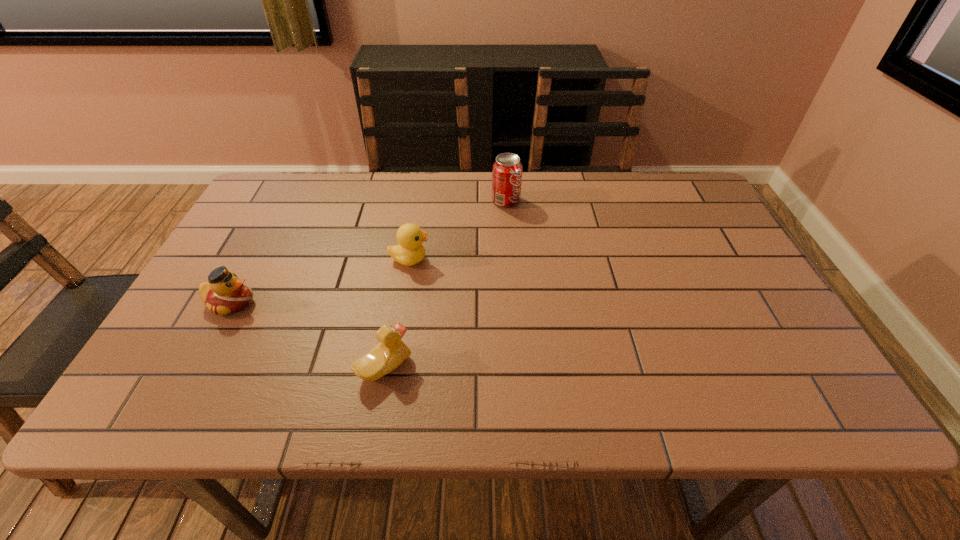
You are a GUI agent. You are given a task and a screenshot of the screen. Output one action in this format:
    pyautogui.click(x=<x>, y=<y>)
    Task: Click on the object that is the third closest one to the leftmost duck
    
    Given the screenshot: What is the action you would take?
    click(x=507, y=169)

Find the location of a particular element. This screenshot has width=960, height=540. object that is the second closest to the nearest object is located at coordinates (225, 293).

Locate an element on the screen. This screenshot has height=540, width=960. duck that can be found as the closest to the nearest object is located at coordinates (410, 251).

Where is `the closest duck to the nearest duck`? This screenshot has height=540, width=960. the closest duck to the nearest duck is located at coordinates (410, 251).

Locate an element on the screen. The width and height of the screenshot is (960, 540). vacant space that satisfies the following two spatial constraints: 1. on the front side of the rightmost object; 2. on the face of the third farthest object is located at coordinates (514, 302).

Find the location of a particular element. The width and height of the screenshot is (960, 540). vacant space that satisfies the following two spatial constraints: 1. on the front side of the tallest object; 2. on the face of the second farthest duck is located at coordinates (514, 302).